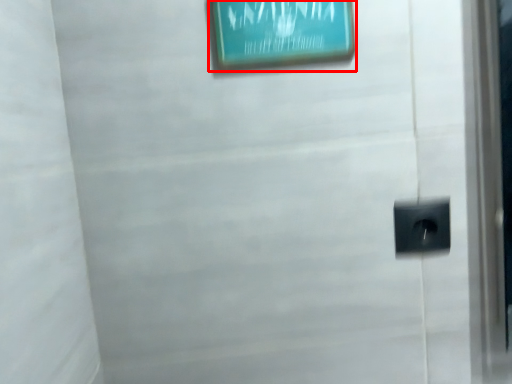
Question: From the image's perspective, what is the correct spatial relationship of picture frame (annotated by the red box) in relation to electric outlet?

Choices:
 (A) above
 (B) below

Answer: (A)